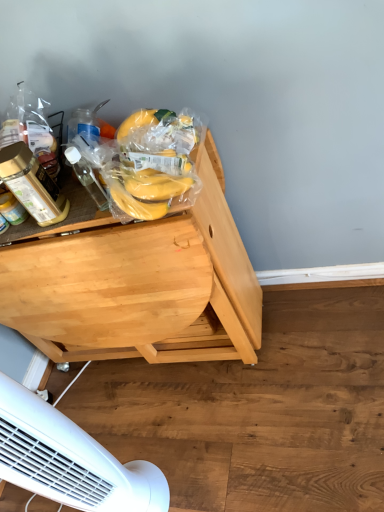
I want to click on unoccupied region to the right of translucent plastic bottle at left, which appears as the 1th bottle when viewed from the left, so pyautogui.click(x=86, y=202).